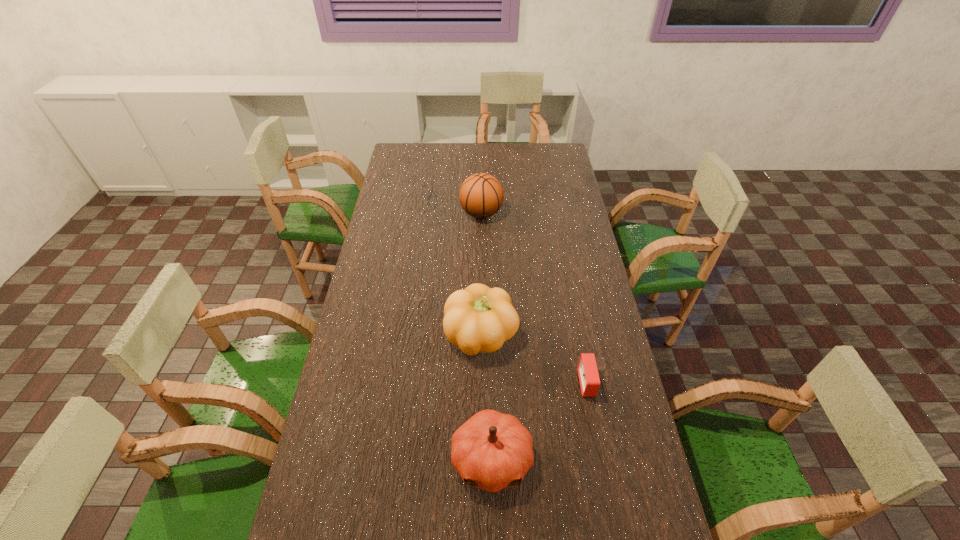
I want to click on vacant space located on the front-facing side of the alarm clock, so click(495, 383).

This screenshot has height=540, width=960. I want to click on object present at the right edge, so click(x=587, y=368).

Find the location of a particular element. The height and width of the screenshot is (540, 960). free space at the far edge is located at coordinates (457, 150).

At what (x,y) coordinates should I click in order to perform the action: click on free point at the left edge. Please return your answer as a coordinate pair (x, y). Looking at the image, I should click on (405, 183).

In the image, there is a desktop. Find the location of `vacant space at the right edge`. vacant space at the right edge is located at coordinates (560, 212).

The height and width of the screenshot is (540, 960). I want to click on free point between the second nearest object and the third nearest object, so click(x=535, y=359).

In order to click on free space between the nearest object and the farther pumpkin in this screenshot , I will do `click(487, 397)`.

At what (x,y) coordinates should I click in order to perform the action: click on empty location between the basketball and the shortest object. Please return your answer as a coordinate pair (x, y). Image resolution: width=960 pixels, height=540 pixels. Looking at the image, I should click on (535, 298).

In order to click on free space between the nearer pumpkin and the shortest object in this screenshot , I will do `click(540, 421)`.

Where is `vacant region between the third nearest object and the shortest object`? This screenshot has width=960, height=540. vacant region between the third nearest object and the shortest object is located at coordinates (535, 359).